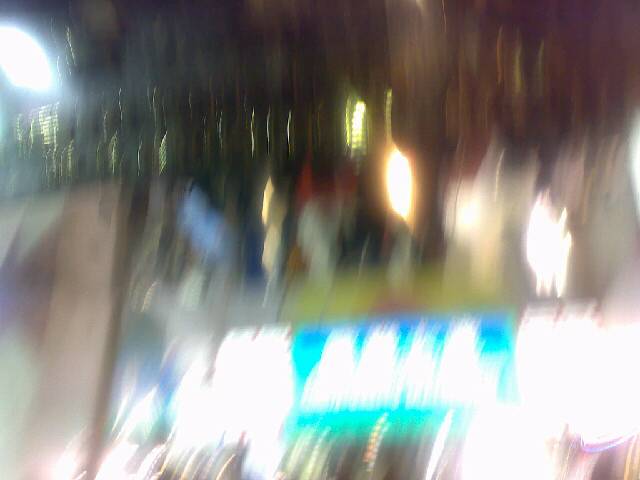
In order to click on bright light in upper left corner in this screenshot , I will do `click(27, 61)`.